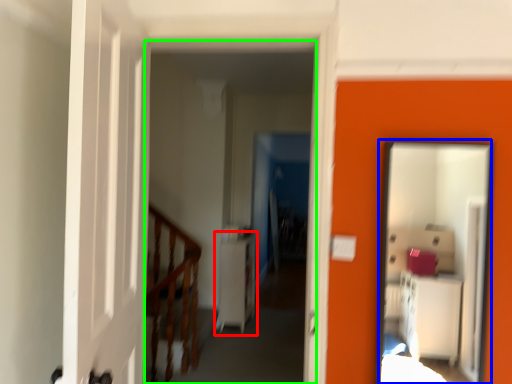
Question: Which object is the closest to the dresser (highlighted by a red box)? Choose among these: mirror (highlighted by a blue box) or corridor (highlighted by a green box).

Choices:
 (A) mirror
 (B) corridor

Answer: (B)